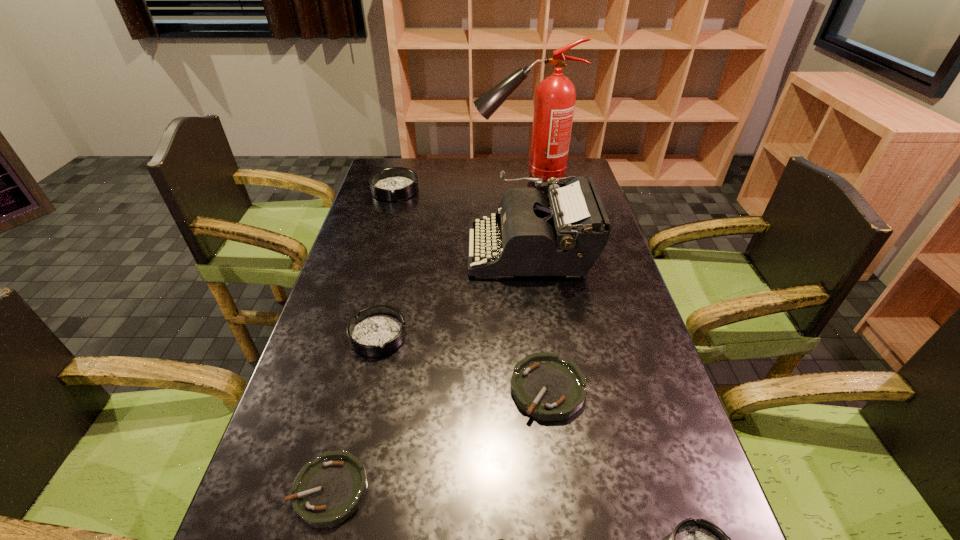
Identify the location of free space located on the left of the farthest green ashtray. (410, 388).

At what (x,y) coordinates should I click in order to perform the action: click on free space located 0.360m on the right of the seventh tallest object. Please return your answer as a coordinate pair (x, y). Looking at the image, I should click on (557, 490).

What are the coordinates of `fire extinguisher that is positioned at the far edge` in the screenshot? It's located at (555, 96).

Identify the location of ashtray at the far edge. This screenshot has height=540, width=960. (393, 184).

Where is `fire extinguisher located in the right edge section of the desktop`? fire extinguisher located in the right edge section of the desktop is located at coordinates (555, 96).

In order to click on typewriter that is at the right edge in this screenshot , I will do tap(566, 237).

The image size is (960, 540). Find the location of `object present at the far left corner`. object present at the far left corner is located at coordinates (393, 184).

This screenshot has width=960, height=540. I want to click on object situated at the far right corner, so click(555, 96).

You are a GUI agent. You are given a task and a screenshot of the screen. Output one action in this format:
    pyautogui.click(x=<x>, y=<y>)
    Task: Click on the vacant position at the far edge of the desktop
    The image size is (960, 540).
    Given the screenshot: What is the action you would take?
    pyautogui.click(x=459, y=176)

Locate an element on the screen. The width and height of the screenshot is (960, 540). vacant region at the left edge of the desktop is located at coordinates (370, 201).